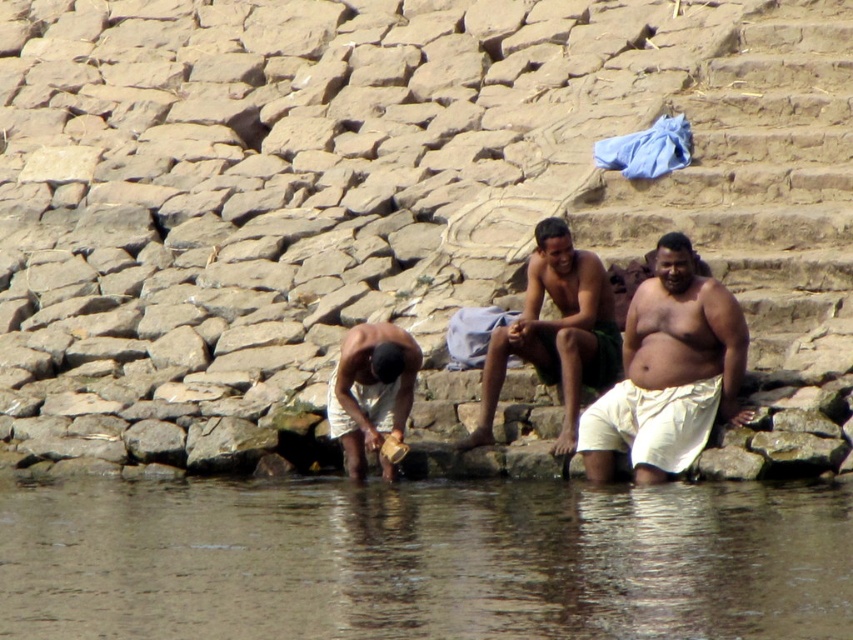
Who is more forward, (x=346, y=525) or (x=724, y=401)?

Point (x=346, y=525)

Between brown water at lower center and white cotton cloth at center, which one appears on the right side from the viewer's perspective?

white cotton cloth at center is more to the right.

Is point (67, 632) behind point (675, 328)?

That is False.

What are the coordinates of `brown water at lower center` in the screenshot? It's located at (422, 561).

Who is lower down, white cotton cloth at center or dark green fabric at center?

white cotton cloth at center is below.

Is white cotton cloth at center shorter than dark green fabric at center?

Incorrect, white cotton cloth at center's height does not fall short of dark green fabric at center's.

Is point (685, 323) positioned after point (498, 387)?

No, it is not.

At what (x,y) coordinates should I click in order to perform the action: click on white cotton cloth at center. Please return your answer as a coordinate pair (x, y). Looking at the image, I should click on (668, 372).

Between white cotton cloth at center and white cloth at lower left, which one is positioned lower?

white cloth at lower left

Identify the location of white cotton cloth at center. (668, 372).